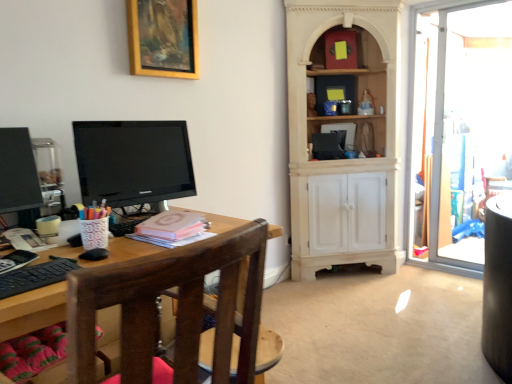
What is the approximate width of transparent glass door at right?

transparent glass door at right is 4.57 inches wide.

At what (x,y) coordinates should I click in order to perform the action: click on pink matte book at center. Please return your answer as a coordinate pair (x, y). The height and width of the screenshot is (384, 512). Looking at the image, I should click on [172, 225].

What is the approximate width of brown wooden chair at left?

It is 22.32 inches.

Find the location of a particular element. This screenshot has height=384, width=512. transparent glass door at right is located at coordinates (460, 128).

Identify the location of computer keyboard located below the pink matte book at center (from the image's perspective). This screenshot has height=384, width=512. (35, 276).

Is black textured keyboard at left aimed at pink matte book at center?

No, black textured keyboard at left is not facing towards pink matte book at center.

What's the angular difference between black textured keyboard at left and pink matte book at center's facing directions?

The facing directions of black textured keyboard at left and pink matte book at center are 0.93 degrees apart.

Considering the sizes of objects brown wooden chair at left and matte black monitor at left in the image provided, who is wider, brown wooden chair at left or matte black monitor at left?

brown wooden chair at left.

In the scene shown: Which is more to the left, brown wooden chair at left or matte black monitor at left?

Positioned to the left is matte black monitor at left.

In terms of height, does brown wooden chair at left look taller or shorter compared to matte black monitor at left?

Considering their sizes, brown wooden chair at left has more height than matte black monitor at left.

Identify the location of computer monitor lying on the left of brown wooden chair at left. The width and height of the screenshot is (512, 384). (18, 172).

Between black textured keyboard at left and gold wooden picture frame at upper center, which one has larger size?

gold wooden picture frame at upper center is bigger.

Looking at this image, based on their positions, is black textured keyboard at left located to the left or right of gold wooden picture frame at upper center?

In the image, black textured keyboard at left appears on the left side of gold wooden picture frame at upper center.

Considering the sizes of objects black textured keyboard at left and gold wooden picture frame at upper center in the image provided, who is thinner, black textured keyboard at left or gold wooden picture frame at upper center?

Result: gold wooden picture frame at upper center.

Locate an element on the screen. Image resolution: width=512 pixels, height=384 pixels. picture frame that is above the black textured keyboard at left (from the image's perspective) is located at coordinates (163, 38).

Locate an element on the screen. This screenshot has width=512, height=384. computer keyboard in front of the gold wooden picture frame at upper center is located at coordinates pyautogui.click(x=35, y=276).

Which is less distant, (182, 37) or (48, 275)?

Point (182, 37) appears to be farther away from the viewer than point (48, 275).

Is gold wooden picture frame at upper center located outside black textured keyboard at left?

gold wooden picture frame at upper center lies outside black textured keyboard at left's area.

From the image's perspective, is gold wooden picture frame at upper center on black textured keyboard at left?

Indeed, from the image's perspective, gold wooden picture frame at upper center is shown above black textured keyboard at left.

From a real-world perspective, does matte black monitor at left stand above gold wooden picture frame at upper center?

No.

From the image's perspective, which object appears higher, matte black monitor at left or gold wooden picture frame at upper center?

gold wooden picture frame at upper center is shown above in the image.

Is matte black monitor at left in contact with gold wooden picture frame at upper center?

No, matte black monitor at left is not beside gold wooden picture frame at upper center.

Does matte black monitor at left have a larger size compared to gold wooden picture frame at upper center?

Incorrect, matte black monitor at left is not larger than gold wooden picture frame at upper center.

Is matte black monitor at left bigger or smaller than black textured keyboard at left?

matte black monitor at left is bigger than black textured keyboard at left.

Considering the sizes of matte black monitor at left and black textured keyboard at left in the image, is matte black monitor at left wider or thinner than black textured keyboard at left?

matte black monitor at left is wider than black textured keyboard at left.

Consider the image. Is matte black monitor at left not near black textured keyboard at left?

No, there isn't a large distance between matte black monitor at left and black textured keyboard at left.

Is matte black monitor at left positioned behind black textured keyboard at left?

That is True.

From a real-world perspective, is matte black monitor at left on top of pink matte book at center?

Yes.

In the scene shown: Which is behind, matte black monitor at left or pink matte book at center?

matte black monitor at left is further from the camera.

Is matte black monitor at left turned away from pink matte book at center?

That's not correct — matte black monitor at left is not looking away from pink matte book at center.

I want to click on book in front of the matte black monitor at left, so click(172, 225).

This screenshot has width=512, height=384. In order to click on book behind the black textured keyboard at left in this screenshot , I will do `click(172, 225)`.

The image size is (512, 384). I want to click on computer monitor positioned vertically above the brown wooden chair at left (from a real-world perspective), so click(x=18, y=172).

Based on their spatial positions, is transparent glass door at right or matte black monitor at left further from black textured keyboard at left?

transparent glass door at right is further to black textured keyboard at left.

From the image, which object appears to be farther from matte black monitor at left, pink matte book at center or gold wooden picture frame at upper center?

gold wooden picture frame at upper center.

Considering their positions, is pink matte book at center positioned closer to matte black monitor at left than matte black monitor at left?

pink matte book at center lies closer to matte black monitor at left than the other object.

Considering their positions, is matte black monitor at left positioned further to black textured keyboard at left than matte black monitor at left?

matte black monitor at left is further to black textured keyboard at left.

Considering their positions, is brown wooden chair at left positioned closer to matte black monitor at left than gold wooden picture frame at upper center?

gold wooden picture frame at upper center.

From the picture: From the image, which object appears to be farther from gold wooden picture frame at upper center, transparent glass door at right or black textured keyboard at left?

transparent glass door at right lies further to gold wooden picture frame at upper center than the other object.

Which object lies further to the anchor point black textured keyboard at left, gold wooden picture frame at upper center or brown wooden chair at left?

gold wooden picture frame at upper center.

When comparing their distances from transparent glass door at right, does brown wooden chair at left or matte black monitor at left seem further?

brown wooden chair at left.

Locate an element on the screen. computer keyboard between matte black monitor at left and pink matte book at center is located at coordinates (35, 276).

You are a GUI agent. You are given a task and a screenshot of the screen. Output one action in this format:
    pyautogui.click(x=<x>, y=<y>)
    Task: Click on the computer monitor located between brown wooden chair at left and gold wooden picture frame at upper center in the depth direction
    
    Given the screenshot: What is the action you would take?
    pyautogui.click(x=18, y=172)

Locate an element on the screen. This screenshot has width=512, height=384. book between black textured keyboard at left and matte black monitor at left in the front-back direction is located at coordinates (172, 225).

Identify the location of computer keyboard between brown wooden chair at left and pink matte book at center in the front-back direction. This screenshot has height=384, width=512. click(x=35, y=276).